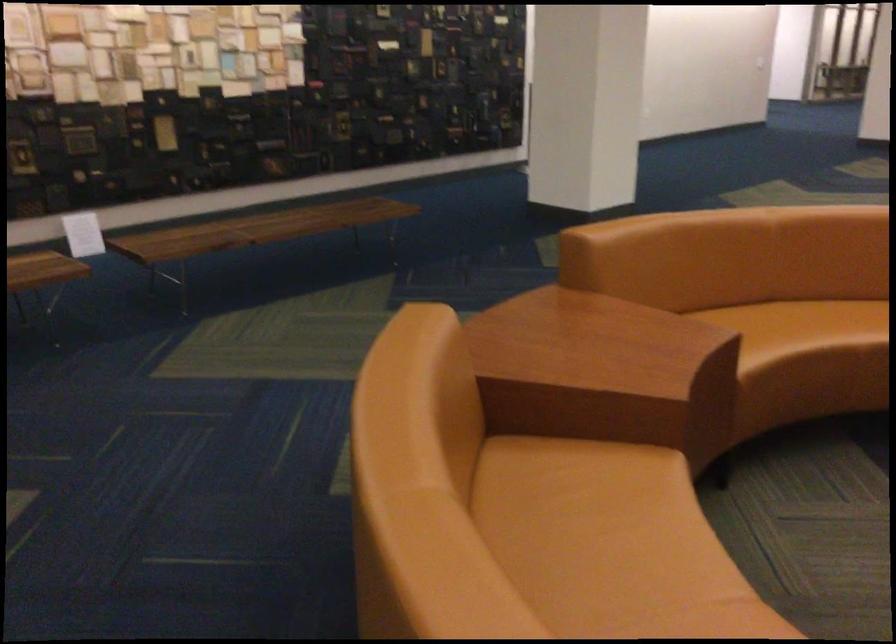
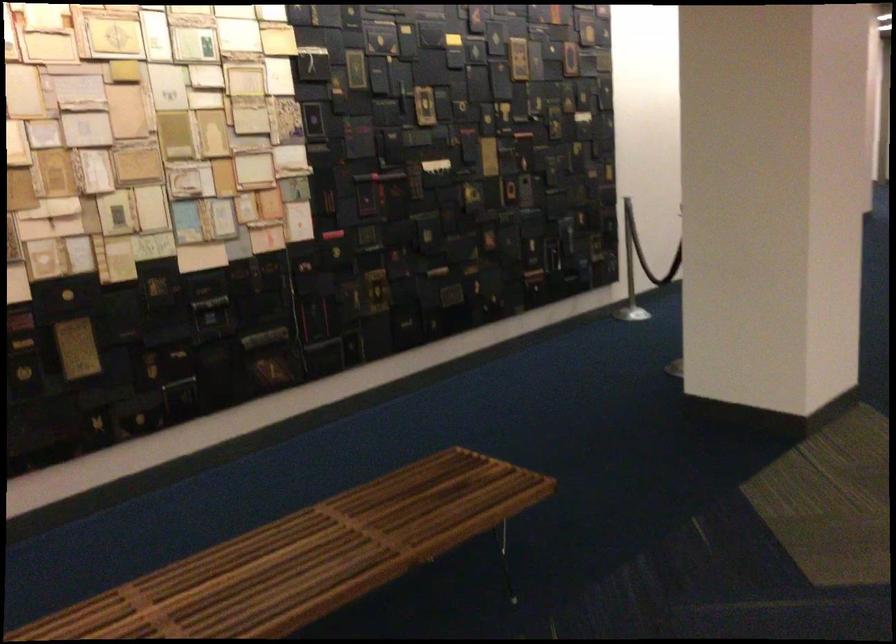
Question: In a continuous first-person perspective shot, in which direction is the camera moving?

Choices:
 (A) Left
 (B) Right
 (C) Forward
 (D) Backward

Answer: (C)